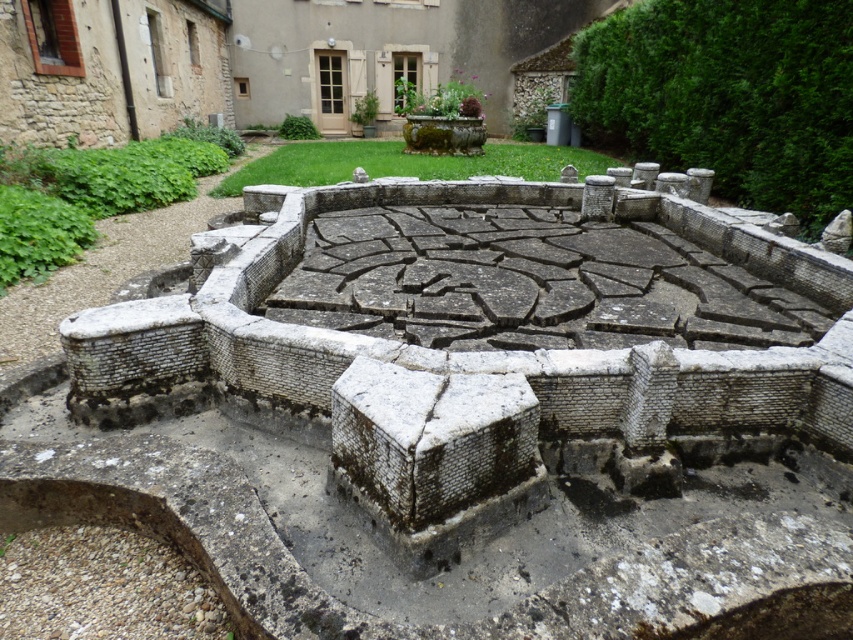
You are an architect examining the ancient stone structure. You notice the gray stone wall at upper right and the green leafy plant at left. Which object is taller?

The gray stone wall at upper right is taller than the green leafy plant at left according to the description.

You are standing at the entrance of the gray stone maze at center. What are the coordinates of the exit?

The coordinates of the exit of the gray stone maze at center are not provided in the given information.